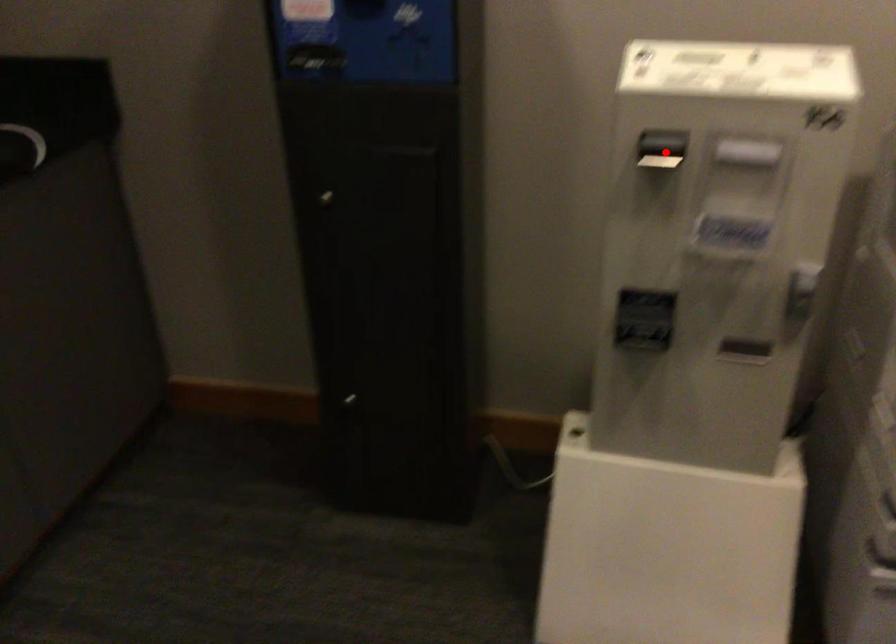
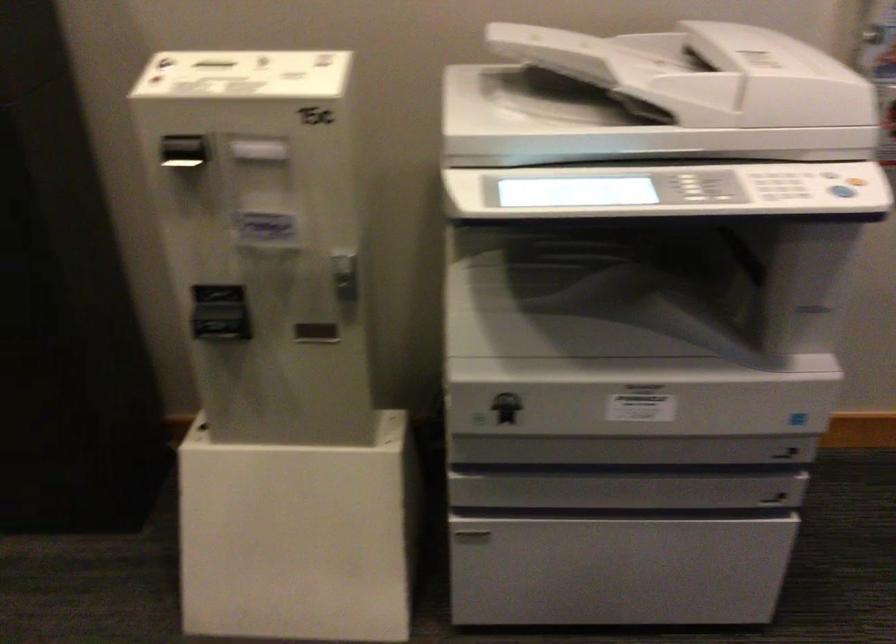
Find the pixel in the second image that matches the highlighted location in the first image.

(185, 156)